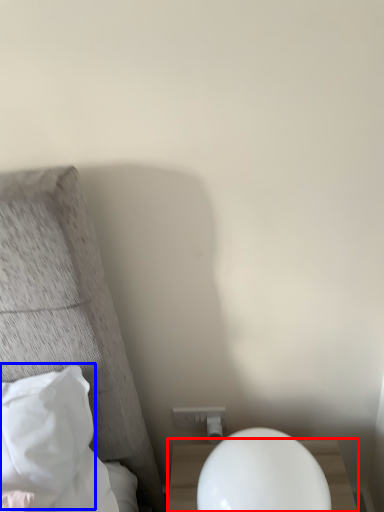
Question: Which of the following is the closest to the observer, nightstand (highlighted by a red box) or pillow (highlighted by a blue box)?

Choices:
 (A) nightstand
 (B) pillow

Answer: (A)